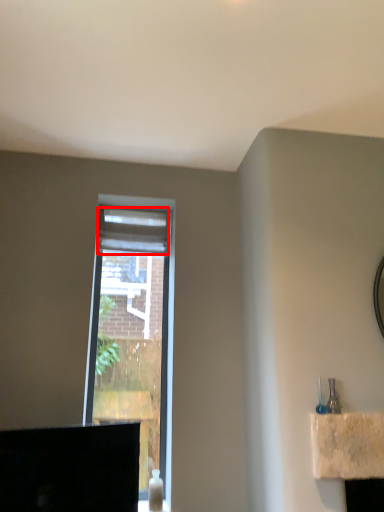
Question: From the image's perspective, where is curtain (annotated by the red box) located in relation to window in the image?

Choices:
 (A) below
 (B) above

Answer: (B)